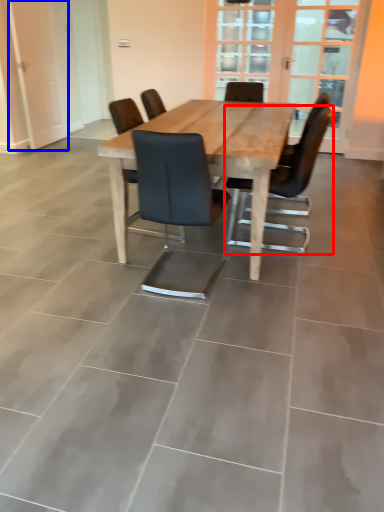
Question: Which point is further to the camera, chair (highlighted by a red box) or screen door (highlighted by a blue box)?

Choices:
 (A) chair
 (B) screen door

Answer: (B)